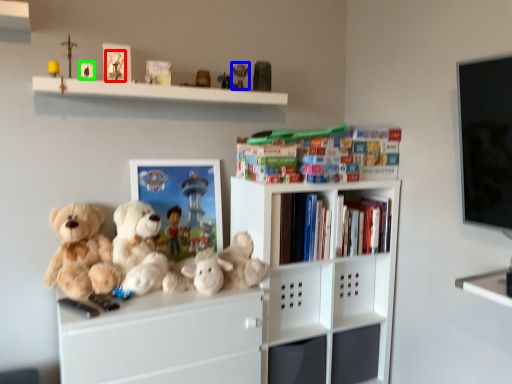
Question: Which object is positioned closest to toy (highlighted by a red box)? Select from toy (highlighted by a blue box) and toy (highlighted by a green box).

Choices:
 (A) toy
 (B) toy

Answer: (B)